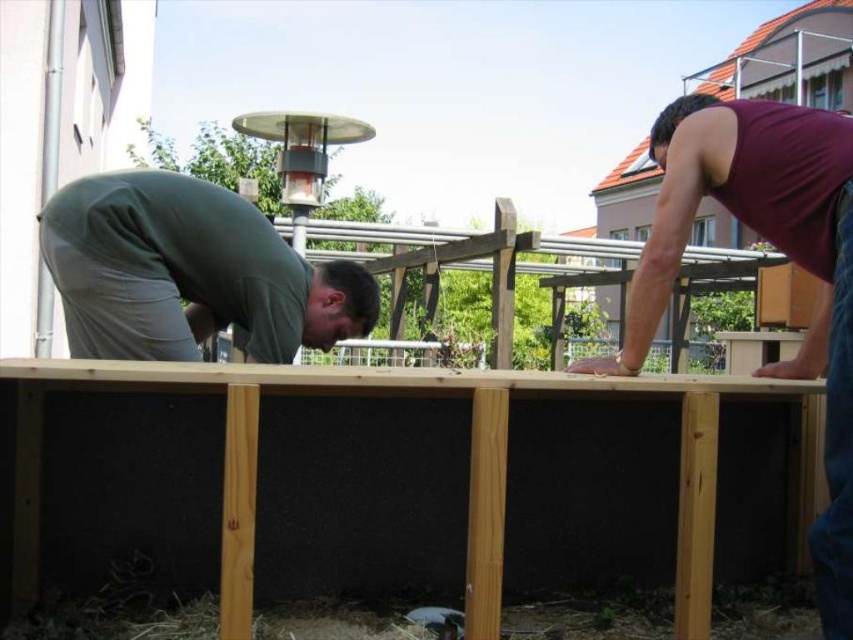
You are a construction worker standing at the origin point with coordinates at 0,0. You need to move towards the maroon tank top at upper right. What direction should you go to reach it?

To reach the maroon tank top at upper right, you should move northeast since its coordinates are at (779, 250), which is northeast of the origin point.

You are standing at the edge of the construction site and see the natural wood foundation at center and the maroon tank top at upper right. Which object is closer to your left side?

The natural wood foundation at center is closer to your left side because it is positioned to the left of the maroon tank top at upper right.